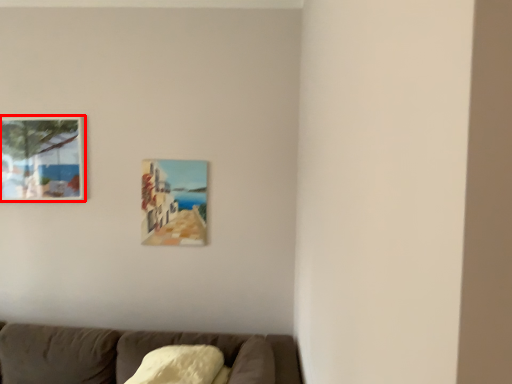
Question: From the image's perspective, where is picture frame (annotated by the red box) located in relation to picture frame in the image?

Choices:
 (A) below
 (B) above

Answer: (B)